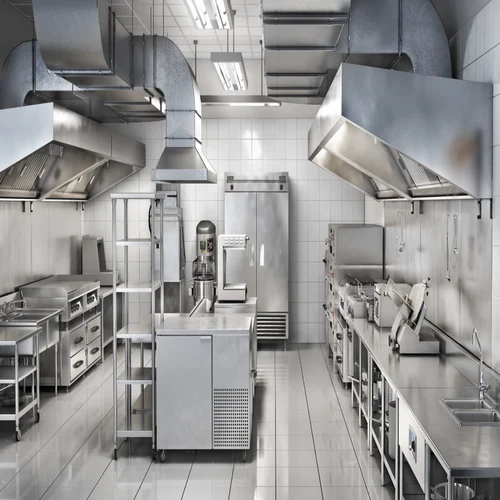
Find the location of `mixer`. mixer is located at coordinates (207, 239).